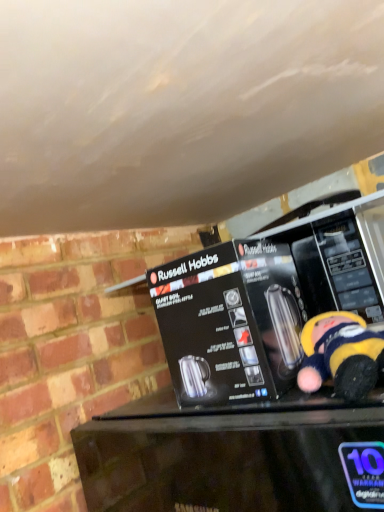
Measure the distance between metallic stainless steel kettle at center and camera.

They are 17.92 inches apart.

Describe the element at coordinates (276, 309) in the screenshot. This screenshot has height=512, width=384. I see `metallic stainless steel kettle at center` at that location.

Where is `metallic stainless steel kettle at center`? This screenshot has height=512, width=384. metallic stainless steel kettle at center is located at coordinates (276, 309).

At what (x,y) coordinates should I click in order to perform the action: click on metallic stainless steel kettle at center. Please return your answer as a coordinate pair (x, y). The image size is (384, 512). Looking at the image, I should click on (276, 309).